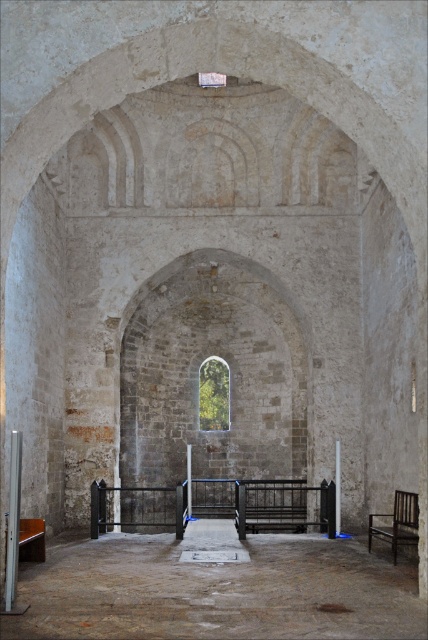
Is point (14, 570) farther from viewer compared to point (32, 552)?

No, it is not.

Where is `smooth gray pillar at left`? The image size is (428, 640). smooth gray pillar at left is located at coordinates (12, 522).

Who is more distant from viewer, [11,464] or [395,499]?

The point [395,499] is more distant.

In order to click on smooth gray pillar at left in this screenshot , I will do `click(12, 522)`.

Measure the distance between point (17, 548) and camera.

They are 22.44 meters apart.

At what (x,y) coordinates should I click in order to perform the action: click on smooth gray pillar at left. Please return your answer as a coordinate pair (x, y). Looking at the image, I should click on (12, 522).

Is brown stone floor at center taller than smooth stone pillar at center?

Yes.

Between brown stone floor at center and smooth stone pillar at center, which one appears on the right side from the viewer's perspective?

From the viewer's perspective, smooth stone pillar at center appears more on the right side.

Where is `brown stone floor at center`? The width and height of the screenshot is (428, 640). brown stone floor at center is located at coordinates (216, 589).